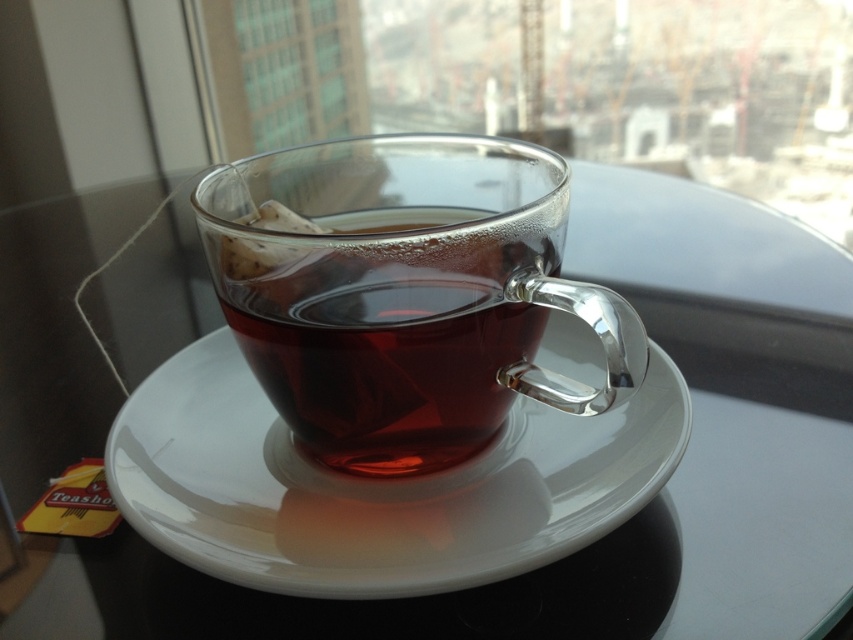
Question: Among these points, which one is farthest from the camera?

Choices:
 (A) (357, 394)
 (B) (263, 552)

Answer: (A)

Question: Is white glossy saucer at center behind transparent glass cup at center?

Choices:
 (A) no
 (B) yes

Answer: (A)

Question: Does white glossy saucer at center have a larger size compared to transparent glass cup at center?

Choices:
 (A) no
 (B) yes

Answer: (B)

Question: Is white glossy saucer at center positioned in front of transparent glass cup at center?

Choices:
 (A) no
 (B) yes

Answer: (B)

Question: Which point appears farthest from the camera in this image?

Choices:
 (A) (514, 323)
 (B) (495, 531)

Answer: (A)